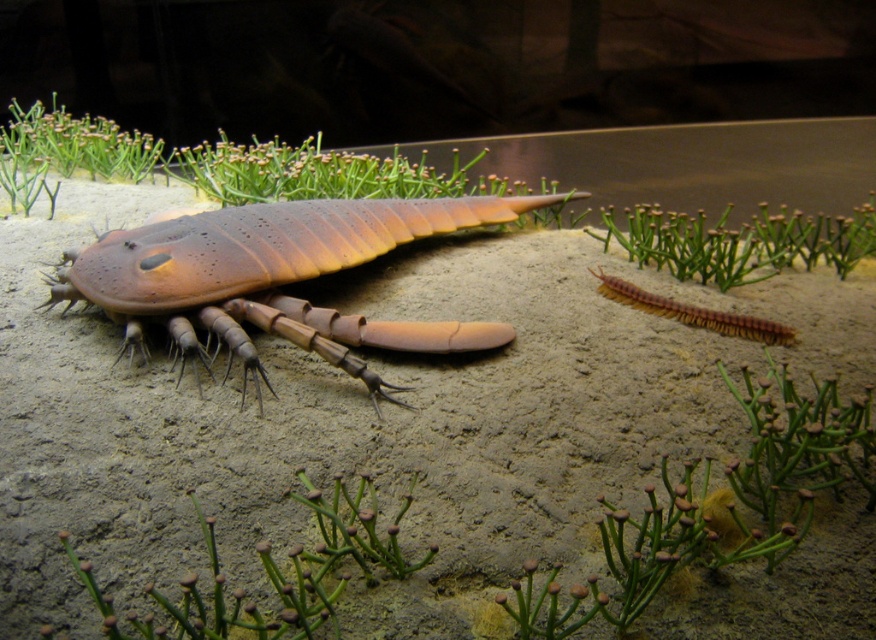
You are a marine biologist examining this prehistoric seabed scene. You notice a point marked at coordinates (288, 269). What organism is located exactly at that point?

The organism located exactly at point (288, 269) is a matte brown crustacean at center.

Looking at this image, you are a paleontologist examining a fossilized trilobite in a museum exhibit. The exhibit has a glass case that is 1.8 meters away from the viewing side. If you stand directly in front of the case, can you clearly see the point at coordinates point (223,230) without needing to move closer?

The point at point (223,230) is 1.79 meters away from the camera, which is slightly closer than the 1.8 meters distance of the glass case. Therefore, you can clearly see the point at point (223,230) without needing to move closer.

You are an underwater explorer examining the prehistoric seabed. You notice a matte brown crustacean at center and a brown fuzzy centipede at lower right. Which creature has a greater width?

The matte brown crustacean at center has a greater width than the brown fuzzy centipede at lower right.